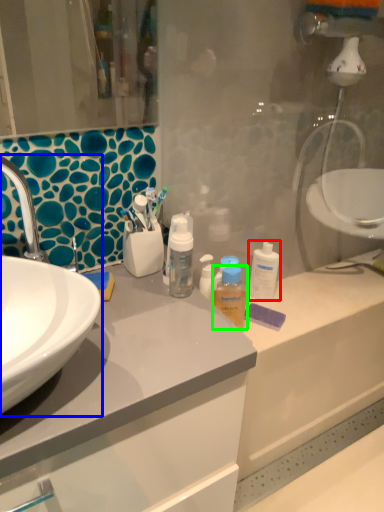
Question: Which object is positioned farthest from cleaning product (highlighted by a red box)? Select from sink (highlighted by a blue box) and mouthwash (highlighted by a green box).

Choices:
 (A) sink
 (B) mouthwash

Answer: (A)